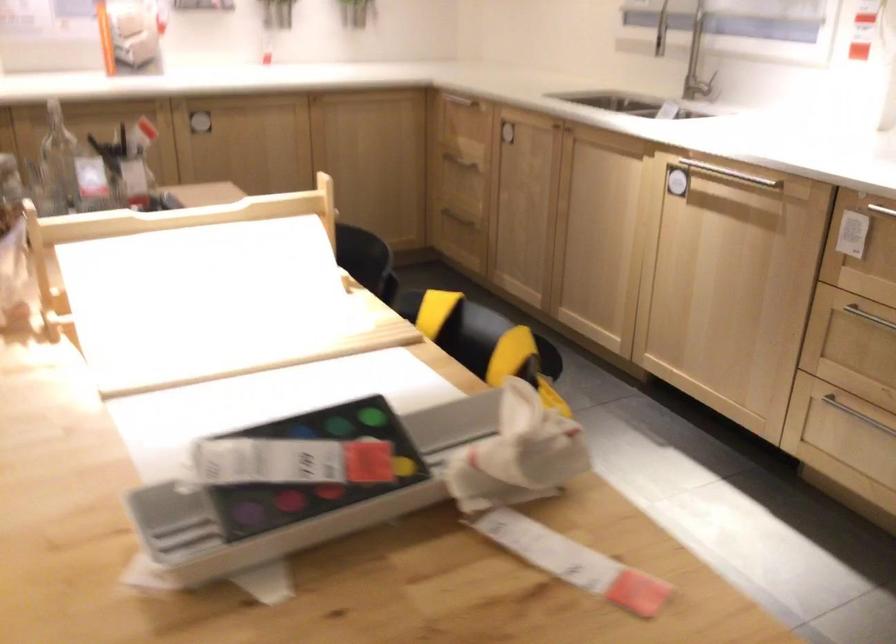
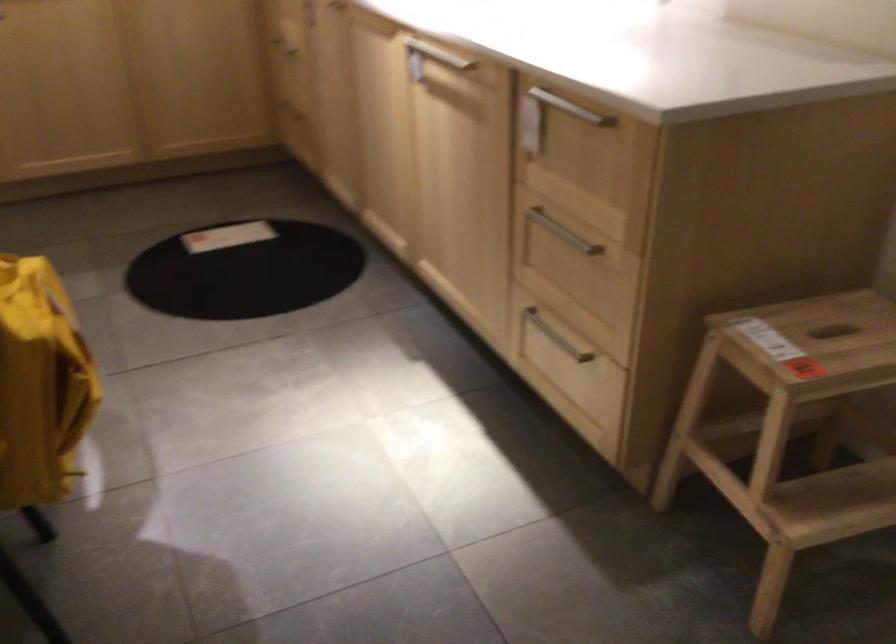
Question: The first image is from the beginning of the video and the second image is from the end. How did the camera likely rotate when shooting the video?

Choices:
 (A) Left
 (B) Right
 (C) Up
 (D) Down

Answer: (D)